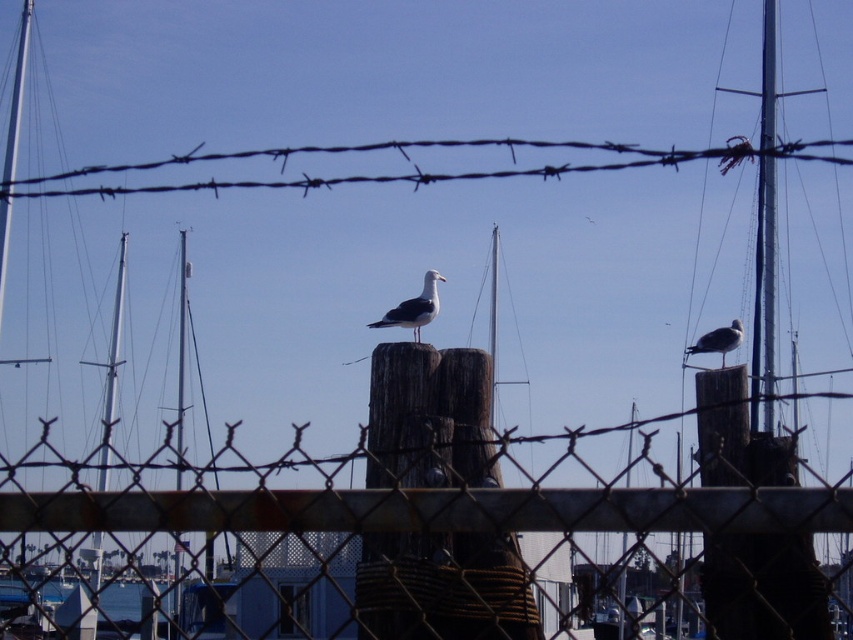
Is metal chain-link fence at center bigger than white matte seagull at center?

Yes, metal chain-link fence at center is bigger than white matte seagull at center.

Does metal chain-link fence at center have a smaller size compared to white matte seagull at center?

No.

Find the location of a particular element. This screenshot has height=640, width=853. metal chain-link fence at center is located at coordinates (434, 509).

Does point (418, 332) come in front of point (709, 348)?

That is True.

Is white matte seagull at center below white matte seagull at upper right?

No, white matte seagull at center is not below white matte seagull at upper right.

Between point (384, 321) and point (723, 336), which one is positioned behind?

The point (723, 336) is behind.

You are a GUI agent. You are given a task and a screenshot of the screen. Output one action in this format:
    pyautogui.click(x=<x>, y=<y>)
    Task: Click on the white matte seagull at center
    Image resolution: width=853 pixels, height=640 pixels.
    Given the screenshot: What is the action you would take?
    pyautogui.click(x=415, y=307)

Does barbed wire at upper center have a smaller size compared to white matte seagull at upper right?

No, barbed wire at upper center is not smaller than white matte seagull at upper right.

Is barbed wire at upper center wider than white matte seagull at upper right?

Correct, the width of barbed wire at upper center exceeds that of white matte seagull at upper right.

The width and height of the screenshot is (853, 640). What do you see at coordinates (477, 172) in the screenshot? I see `barbed wire at upper center` at bounding box center [477, 172].

Where is `barbed wire at upper center`? Image resolution: width=853 pixels, height=640 pixels. barbed wire at upper center is located at coordinates (477, 172).